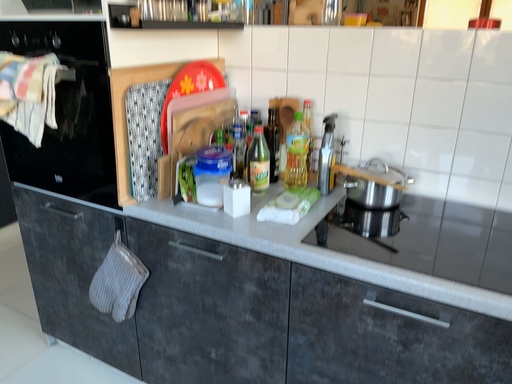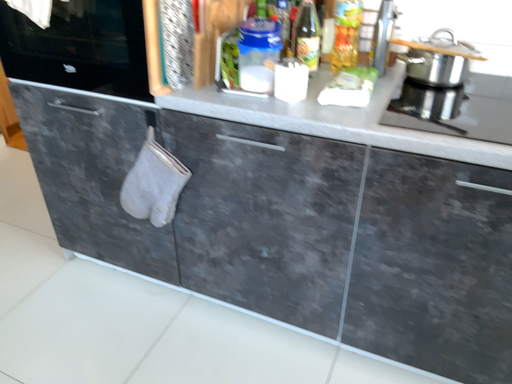
Question: How did the camera likely rotate when shooting the video?

Choices:
 (A) rotated downward
 (B) rotated upward

Answer: (A)